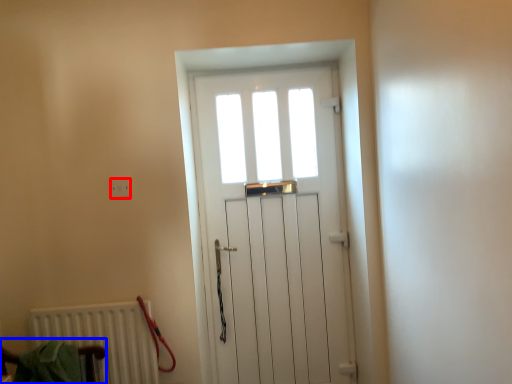
Question: Which point is further to the camera, electric outlet (highlighted by a red box) or armchair (highlighted by a blue box)?

Choices:
 (A) electric outlet
 (B) armchair

Answer: (A)